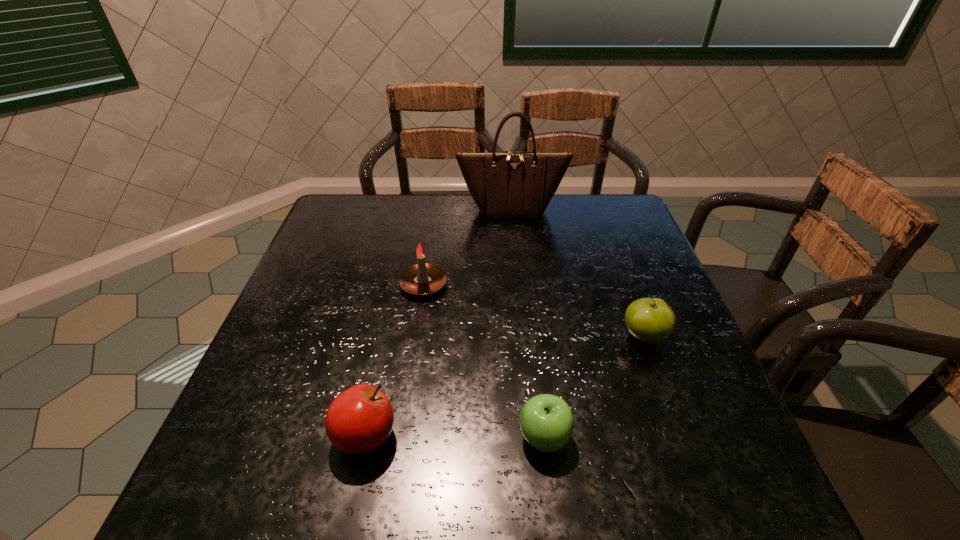
What are the coordinates of `handbag` in the screenshot? It's located at (509, 184).

The height and width of the screenshot is (540, 960). Find the location of `the tallest object`. the tallest object is located at coordinates (509, 184).

Locate an element on the screen. candle is located at coordinates (422, 279).

The height and width of the screenshot is (540, 960). I want to click on the third farthest object, so click(650, 320).

The width and height of the screenshot is (960, 540). Find the location of `the rightmost object`. the rightmost object is located at coordinates (650, 320).

In order to click on the leftmost apple in this screenshot , I will do `click(359, 420)`.

I want to click on the second apple from right to left, so click(x=546, y=421).

Locate an element on the screen. vacant space located on the front-facing side of the tallest object is located at coordinates (520, 295).

This screenshot has width=960, height=540. Find the location of `vacant area situated on the right of the candle`. vacant area situated on the right of the candle is located at coordinates (578, 285).

The height and width of the screenshot is (540, 960). In order to click on free region located on the back of the third nearest object in this screenshot , I will do `click(618, 267)`.